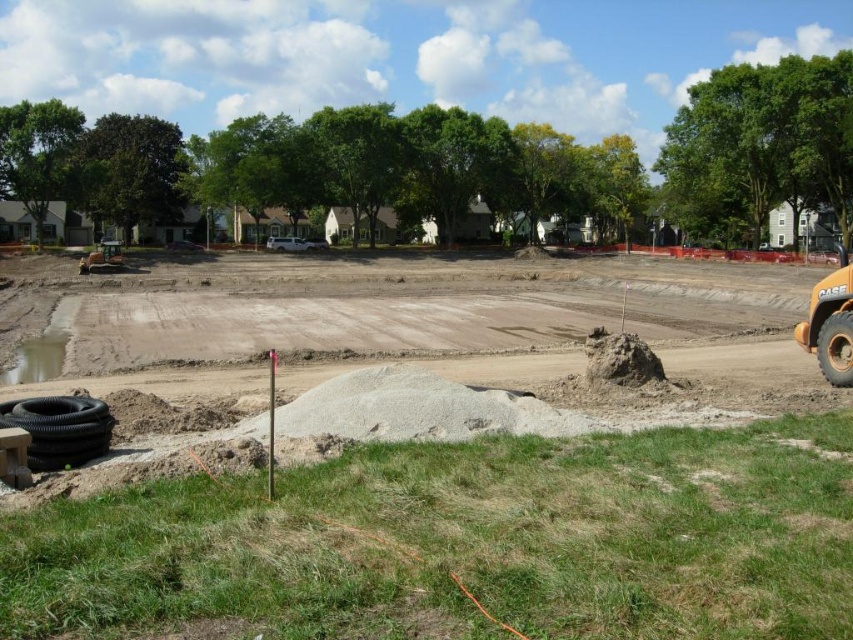
Question: Which object is the closest to the yellow rubber excavator at right?

Choices:
 (A) rubber/textured tire at right
 (B) black rubber tire at lower left

Answer: (A)

Question: Can you confirm if yellow rubber excavator at right is smaller than rubber/textured tire at right?

Choices:
 (A) yes
 (B) no

Answer: (B)

Question: Estimate the real-world distances between objects in this image. Which object is farther from the yellow rubber excavator at right?

Choices:
 (A) rubber/textured tire at right
 (B) black rubber tire at lower left

Answer: (B)

Question: Which object appears farthest from the camera in this image?

Choices:
 (A) yellow rubber excavator at right
 (B) rubber/textured tire at right

Answer: (B)

Question: Can you confirm if black rubber tire at lower left is wider than yellow rubber excavator at right?

Choices:
 (A) no
 (B) yes

Answer: (A)

Question: Considering the relative positions of yellow rubber excavator at right and rubber/textured tire at right in the image provided, where is yellow rubber excavator at right located with respect to rubber/textured tire at right?

Choices:
 (A) below
 (B) above

Answer: (B)